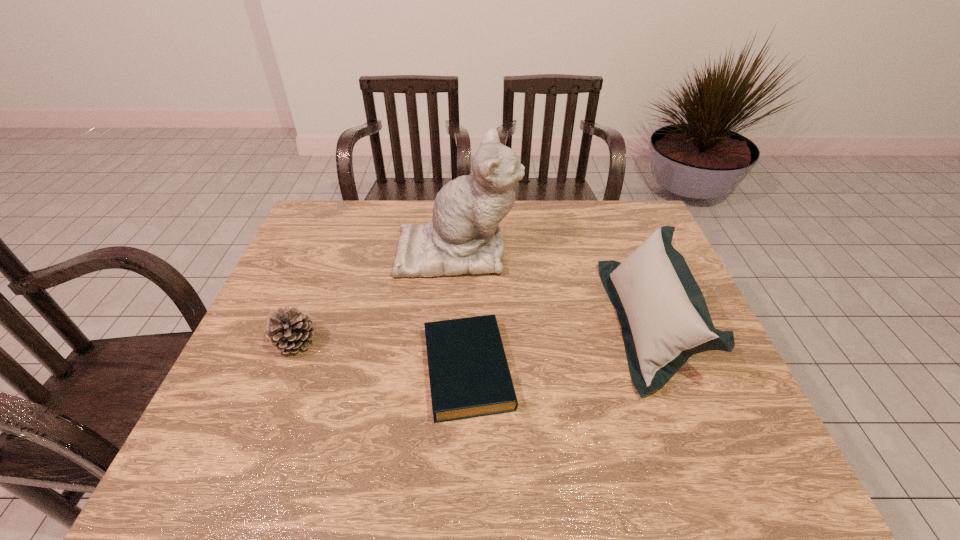
The width and height of the screenshot is (960, 540). I want to click on free point between the tallest object and the cushion, so click(553, 287).

Locate an element on the screen. the second closest object to the leftmost object is located at coordinates (469, 375).

Locate an element on the screen. This screenshot has width=960, height=540. object that can be found as the closest to the cat is located at coordinates click(469, 375).

Where is `free space in the image that satisfies the following two spatial constraints: 1. on the front-facing side of the cat; 2. on the front side of the leftmost object`? This screenshot has height=540, width=960. free space in the image that satisfies the following two spatial constraints: 1. on the front-facing side of the cat; 2. on the front side of the leftmost object is located at coordinates (451, 343).

Locate an element on the screen. free space that satisfies the following two spatial constraints: 1. on the front side of the shortest object; 2. on the right side of the leftmost object is located at coordinates (285, 369).

Locate an element on the screen. The width and height of the screenshot is (960, 540). vacant region that satisfies the following two spatial constraints: 1. on the surface of the rightmost object; 2. on the front side of the pinecone is located at coordinates (656, 343).

I want to click on vacant area in the image that satisfies the following two spatial constraints: 1. on the front-facing side of the shortest object; 2. on the right side of the tallest object, so click(x=450, y=369).

Image resolution: width=960 pixels, height=540 pixels. I want to click on free location that satisfies the following two spatial constraints: 1. on the front side of the shortest object; 2. on the left side of the pinecone, so click(x=285, y=369).

Locate an element on the screen. The width and height of the screenshot is (960, 540). free region that satisfies the following two spatial constraints: 1. on the front-facing side of the cat; 2. on the left side of the book is located at coordinates (450, 369).